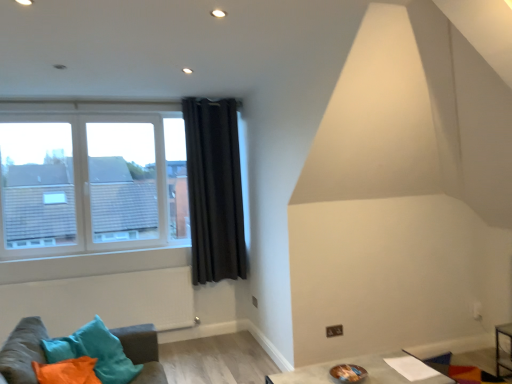
Question: Is smooth gray table at lower center positioned before black velvet curtain at upper center?

Choices:
 (A) no
 (B) yes

Answer: (B)

Question: Considering the relative sizes of smooth gray table at lower center and black velvet curtain at upper center in the image provided, is smooth gray table at lower center wider than black velvet curtain at upper center?

Choices:
 (A) no
 (B) yes

Answer: (B)

Question: Considering the relative sizes of smooth gray table at lower center and black velvet curtain at upper center in the image provided, is smooth gray table at lower center smaller than black velvet curtain at upper center?

Choices:
 (A) yes
 (B) no

Answer: (B)

Question: Is smooth gray table at lower center with black velvet curtain at upper center?

Choices:
 (A) yes
 (B) no

Answer: (B)

Question: Is smooth gray table at lower center thinner than black velvet curtain at upper center?

Choices:
 (A) no
 (B) yes

Answer: (A)

Question: From the image's perspective, is smooth gray table at lower center on black velvet curtain at upper center?

Choices:
 (A) no
 (B) yes

Answer: (A)

Question: From the image's perspective, is velvet teal cushions at lower left beneath black velvet curtain at upper center?

Choices:
 (A) no
 (B) yes

Answer: (B)

Question: From a real-world perspective, is velvet teal cushions at lower left below black velvet curtain at upper center?

Choices:
 (A) no
 (B) yes

Answer: (B)

Question: Is velvet teal cushions at lower left further to camera compared to black velvet curtain at upper center?

Choices:
 (A) no
 (B) yes

Answer: (A)

Question: Can you confirm if velvet teal cushions at lower left is taller than black velvet curtain at upper center?

Choices:
 (A) yes
 (B) no

Answer: (B)

Question: Can you confirm if velvet teal cushions at lower left is thinner than black velvet curtain at upper center?

Choices:
 (A) yes
 (B) no

Answer: (B)

Question: Considering the relative positions of velvet teal cushions at lower left and black velvet curtain at upper center in the image provided, is velvet teal cushions at lower left to the right of black velvet curtain at upper center from the viewer's perspective?

Choices:
 (A) yes
 (B) no

Answer: (B)

Question: Can you confirm if clear glass window at left is smaller than smooth gray table at lower center?

Choices:
 (A) no
 (B) yes

Answer: (A)